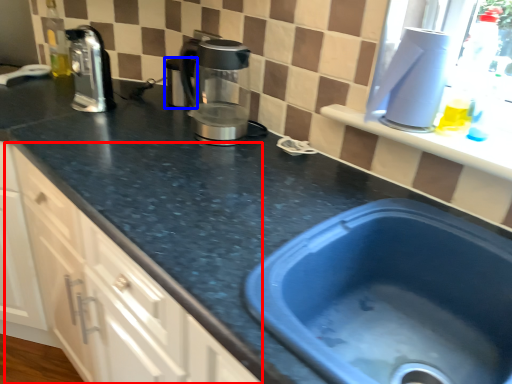
Question: Which object is closer to the camera taking this photo, cabinetry (highlighted by a red box) or appliance (highlighted by a blue box)?

Choices:
 (A) cabinetry
 (B) appliance

Answer: (A)